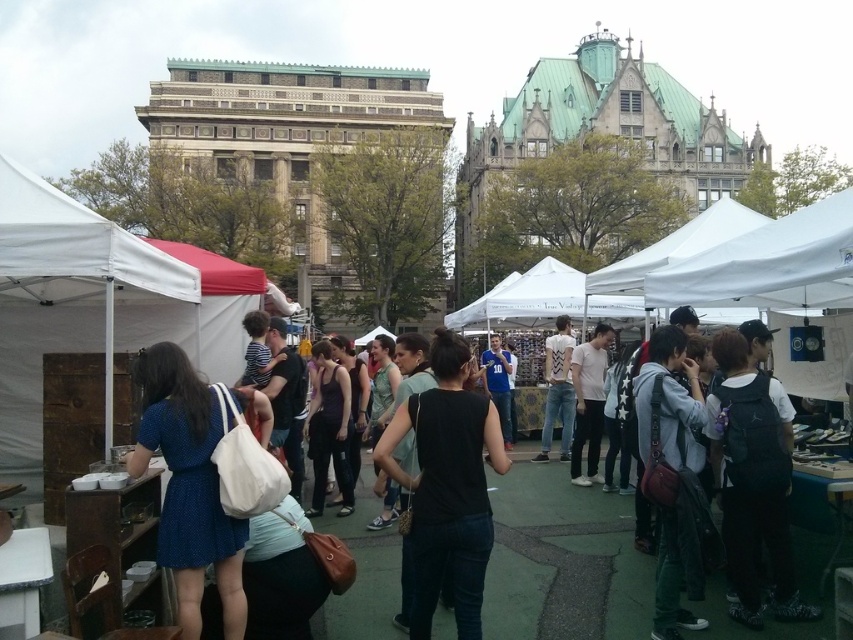
Question: Does white fabric canopy at center appear on the right side of matte purple tank top at center?

Choices:
 (A) yes
 (B) no

Answer: (A)

Question: Is black matte tank top at center to the left of leather backpack at center from the viewer's perspective?

Choices:
 (A) no
 (B) yes

Answer: (B)

Question: Estimate the real-world distances between objects in this image. Which object is closer to the leather backpack at center?

Choices:
 (A) blue dotted dress at center
 (B) blue jersey at center
 (C) white matte t-shirt at center
 (D) black matte backpack at lower right

Answer: (D)

Question: Which point is farther from the camera taking this photo?

Choices:
 (A) (573, 387)
 (B) (463, 381)

Answer: (A)

Question: Among these objects, which one is nearest to the camera?

Choices:
 (A) black matte tank top at center
 (B) white fabric canopy at upper right

Answer: (A)

Question: In this image, where is black matte tank top at center located relative to matte purple tank top at center?

Choices:
 (A) right
 (B) left

Answer: (A)